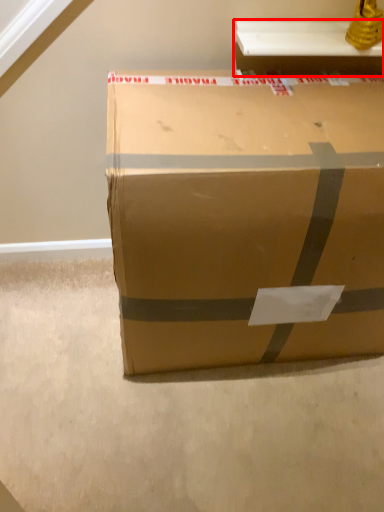
Question: From the image's perspective, considering the relative positions of table (annotated by the red box) and box in the image provided, where is table (annotated by the red box) located with respect to the staircase?

Choices:
 (A) below
 (B) above

Answer: (B)